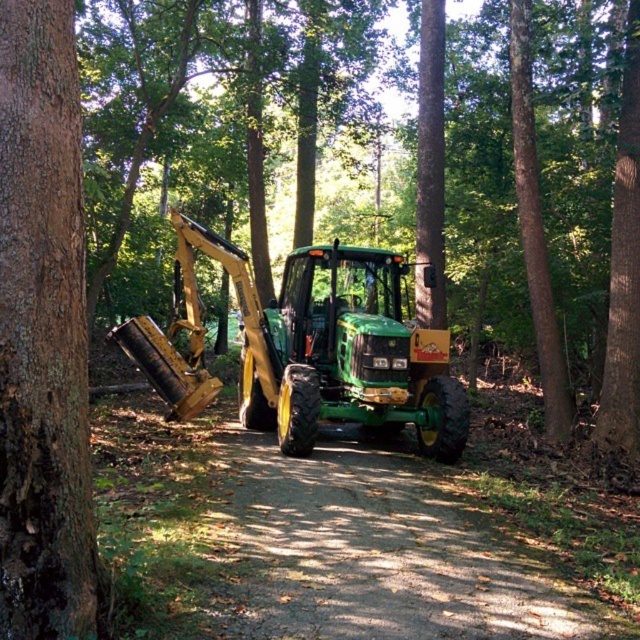
Question: Is brown rough bark tree at center-left closer to camera compared to green matte tractor at center?

Choices:
 (A) no
 (B) yes

Answer: (B)

Question: Where is brown rough bark tree at center-left located in relation to green matte tractor at center in the image?

Choices:
 (A) left
 (B) right

Answer: (A)

Question: Can you confirm if brown rough bark tree at center-left is wider than green matte tractor at center?

Choices:
 (A) no
 (B) yes

Answer: (A)

Question: Which of the following is the farthest from the observer?

Choices:
 (A) (38, 253)
 (B) (337, 330)

Answer: (B)

Question: Among these points, which one is nearest to the camera?

Choices:
 (A) (364, 332)
 (B) (36, 6)

Answer: (B)